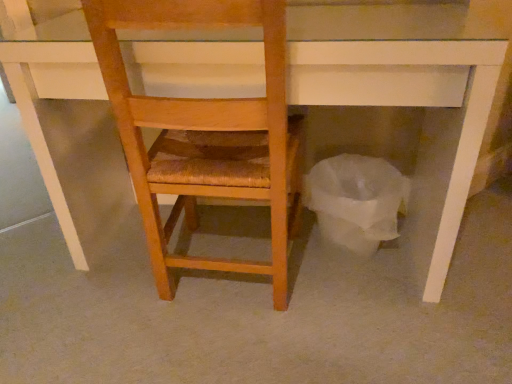
Where is `vacant space to the right of wooden chair at center`? This screenshot has height=384, width=512. vacant space to the right of wooden chair at center is located at coordinates (364, 308).